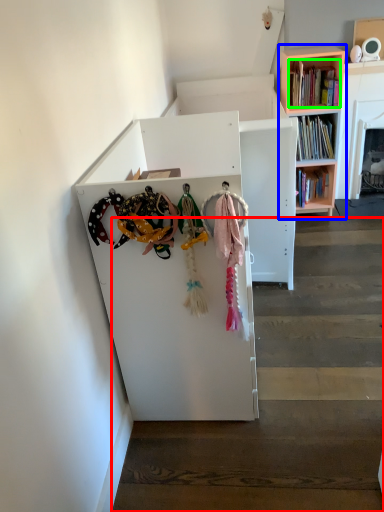
Question: Based on their relative distances, which object is farther from stairwell (highlighted by a red box)? Choose from bookcase (highlighted by a blue box) and book (highlighted by a green box).

Choices:
 (A) bookcase
 (B) book

Answer: (A)